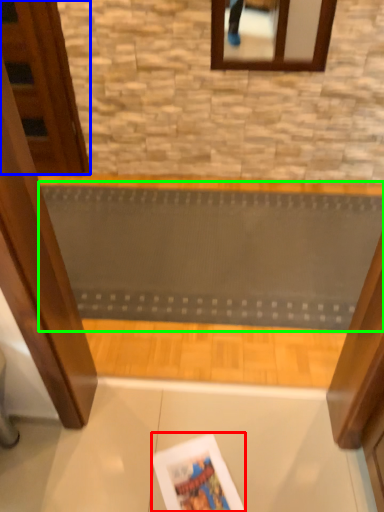
Question: Estimate the real-world distances between objects in this image. Which object is closer to magazine (highlighted by a red box), door (highlighted by a blue box) or ramp (highlighted by a green box)?

Choices:
 (A) door
 (B) ramp

Answer: (B)